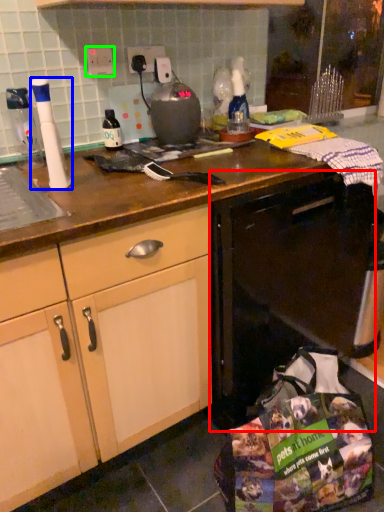
Question: Considering the real-world distances, which object is farthest from dish washer (highlighted by a red box)? kitchen appliance (highlighted by a blue box) or electric outlet (highlighted by a green box)?

Choices:
 (A) kitchen appliance
 (B) electric outlet

Answer: (B)